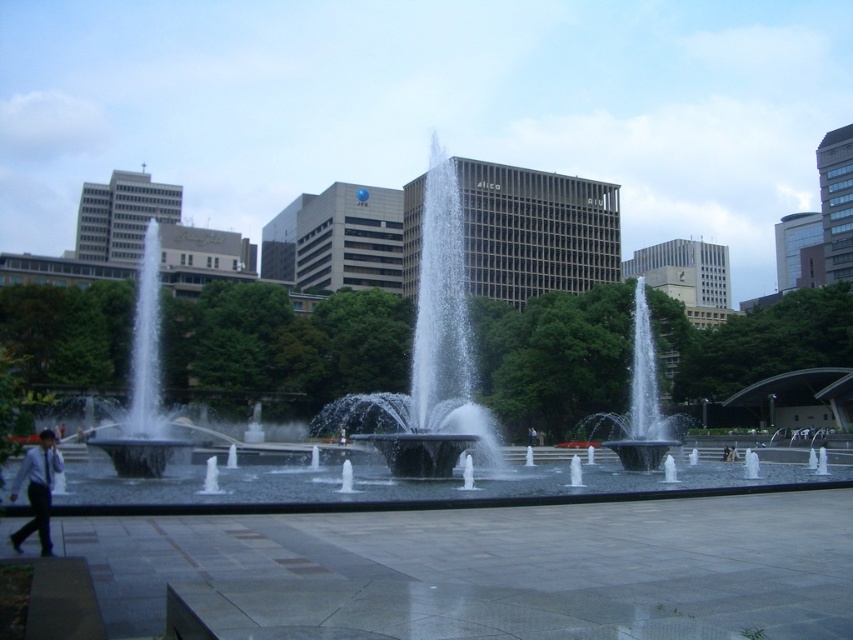
Looking at this image, you are standing on the paved area and want to cross to the other side. There are two clear substances in front of you. One is labeled as clear water at center and the other is clear glass water at center left. Which one should you avoid stepping on to safely reach the other side?

You should avoid stepping on the clear glass water at center left because it is glass and not safe to walk on, while the clear water at center is actual water which is safe to step through.

You are standing on the paved area and want to walk towards the clear glass water at center left without getting your shoes wet. Is the dark gray suit at lower left blocking your path?

The clear glass water at center left is to the left of dark gray suit at lower left, so the dark gray suit at lower left is positioned to the right of the clear glass water at center left. Therefore, the dark gray suit at lower left is not blocking the path to the clear glass water at center left. You can walk towards the clear glass water at center left without obstruction from the dark gray suit at lower left.